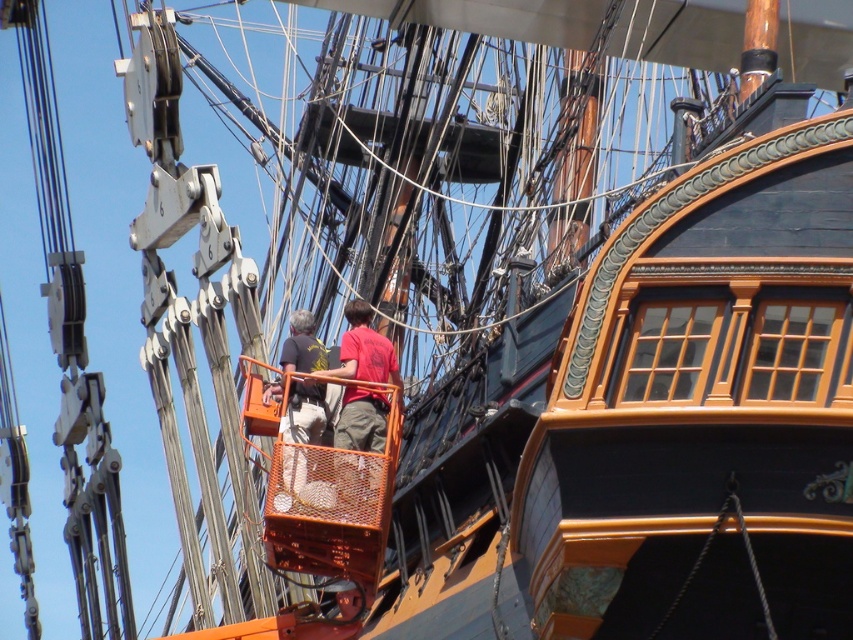
Question: Is dark gray fabric shirt at center smaller than red matte shirt at center?

Choices:
 (A) yes
 (B) no

Answer: (B)

Question: Is dark gray fabric shirt at center smaller than red matte shirt at center?

Choices:
 (A) no
 (B) yes

Answer: (A)

Question: Considering the relative positions of dark gray fabric shirt at center and red matte shirt at center in the image provided, where is dark gray fabric shirt at center located with respect to red matte shirt at center?

Choices:
 (A) left
 (B) right

Answer: (A)